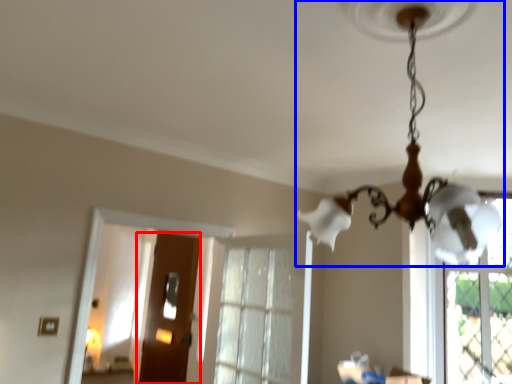
Question: Among these objects, which one is nearest to the camera, door (highlighted by a red box) or lamp (highlighted by a blue box)?

Choices:
 (A) door
 (B) lamp

Answer: (B)